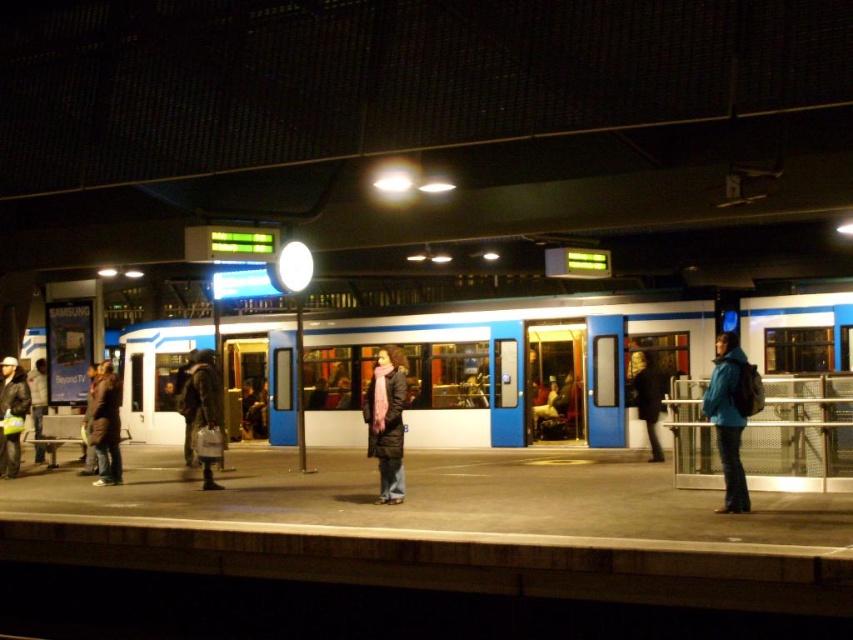
You are a photographer trying to capture a wide shot of the train station platform. You notice the matte black jacket at center and the dark blue jeans at lower left. Which object should you frame closer to the edge of your photo to ensure both are visible without cropping?

The matte black jacket at center has a smaller width than the dark blue jeans at lower left. To ensure both are visible without cropping, frame the wider dark blue jeans at lower left closer to the edge of the photo since it occupies more space.

You are standing on the train platform and see the matte black jacket at center and the dark blue jeans at lower left. Which one is positioned more to the right side of the platform?

The matte black jacket at center is positioned more to the right side of the platform than the dark blue jeans at lower left.